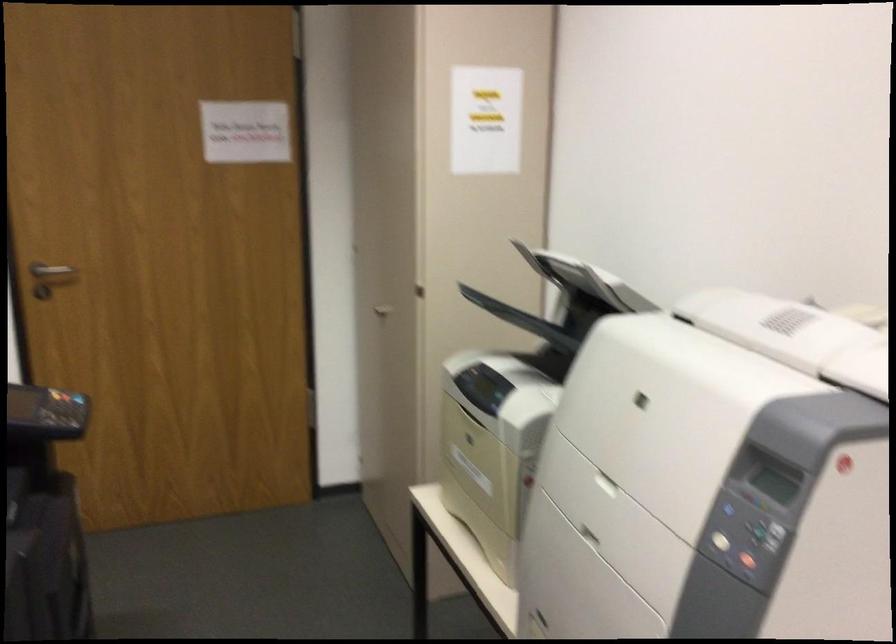
This screenshot has height=644, width=896. In order to click on red printer button in this screenshot , I will do `click(753, 553)`.